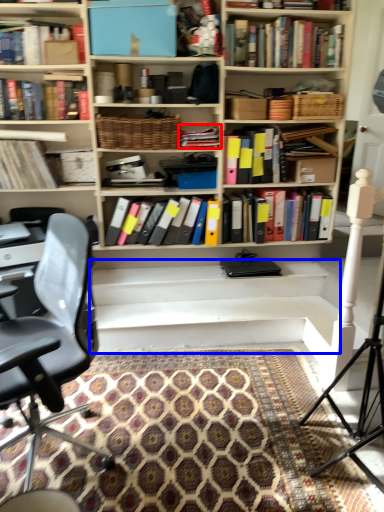
Question: Which of the following is the farthest to the observer, book (highlighted by a red box) or stairwell (highlighted by a blue box)?

Choices:
 (A) book
 (B) stairwell

Answer: (A)